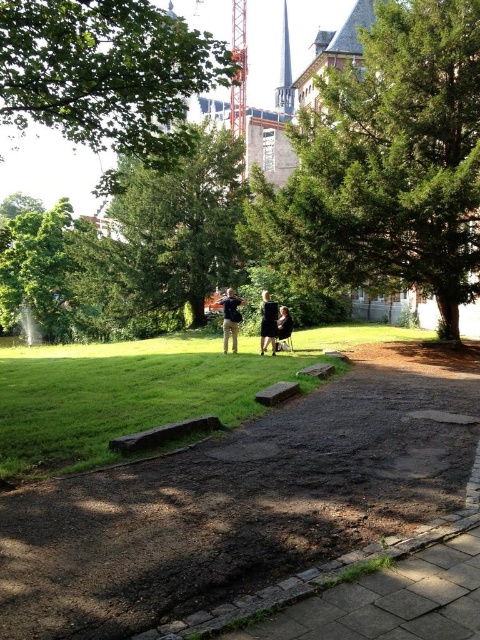
You are planning to walk a 1.5 meter wide delivery cart along the paved pathway in the park. The pathway is bordered by a brown dirt path at center and a green leafy tree at center. Based on the scene, will the paved pathway between these two objects be wide enough for your cart?

The brown dirt path at center is narrower than the green leafy tree at center, but the exact width isn

You are standing at the entrance of the park and want to reach the brown dirt path at center. According to the coordinates provided, in which direction should you walk from your current position?

The brown dirt path at center is located at coordinates point (242, 500), so you should walk towards the center of the park to reach it.

You are planning to plant a new tree in the park. The existing green textured tree at center is already occupying space. Can the brown wooden bench at lower center be placed closer to the tree without being overshadowed by its canopy?

The green textured tree at center has a larger size compared to the brown wooden bench at lower center. Since the tree is bigger, its canopy might overshadow the bench if placed too close. To ensure the bench remains in sunlight, it should be positioned at a distance from the tree.